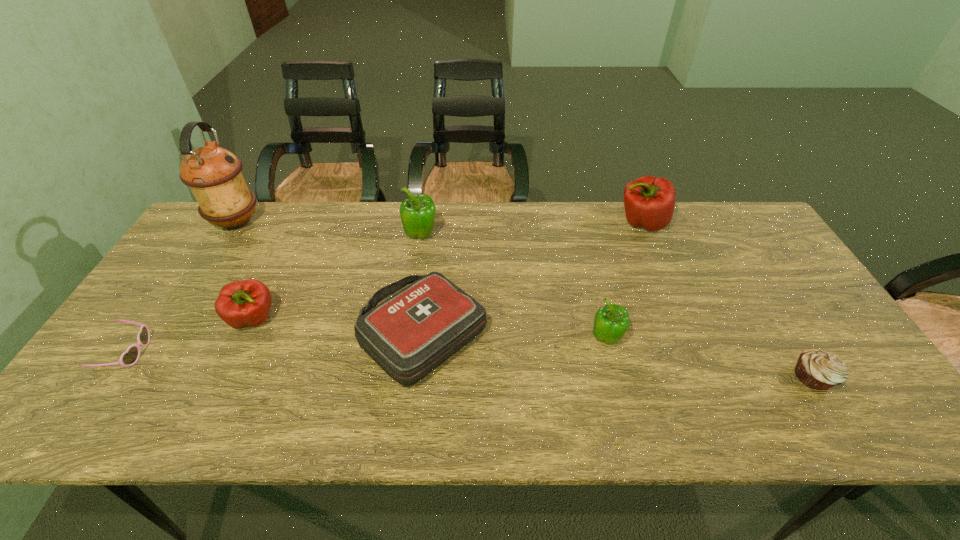
Find the location of a particular element. The image size is (960, 540). vacant region located 0.330m on the back of the third shortest object is located at coordinates (437, 214).

Identify the location of free space located on the back of the second shortest object. coord(740,259).

Locate an element on the screen. vacant space situated 0.150m on the front-facing side of the pink sunglasses is located at coordinates (208, 353).

Where is `oil lamp that is at the far edge`? oil lamp that is at the far edge is located at coordinates (213, 174).

Identify the location of oil lamp at the left edge. This screenshot has width=960, height=540. (213, 174).

Locate an element on the screen. sunglasses present at the left edge is located at coordinates (130, 357).

Locate an element on the screen. The image size is (960, 540). object at the right edge is located at coordinates (817, 369).

Where is `object at the far left corner`? object at the far left corner is located at coordinates (213, 174).

The width and height of the screenshot is (960, 540). What are the coordinates of `free space at the far edge of the desktop` in the screenshot? It's located at (570, 230).

You are a GUI agent. You are given a task and a screenshot of the screen. Output one action in this format:
    pyautogui.click(x=<x>, y=<y>)
    Task: Click on the vacant area at the near edge
    Image resolution: width=960 pixels, height=540 pixels.
    Given the screenshot: What is the action you would take?
    pyautogui.click(x=158, y=431)